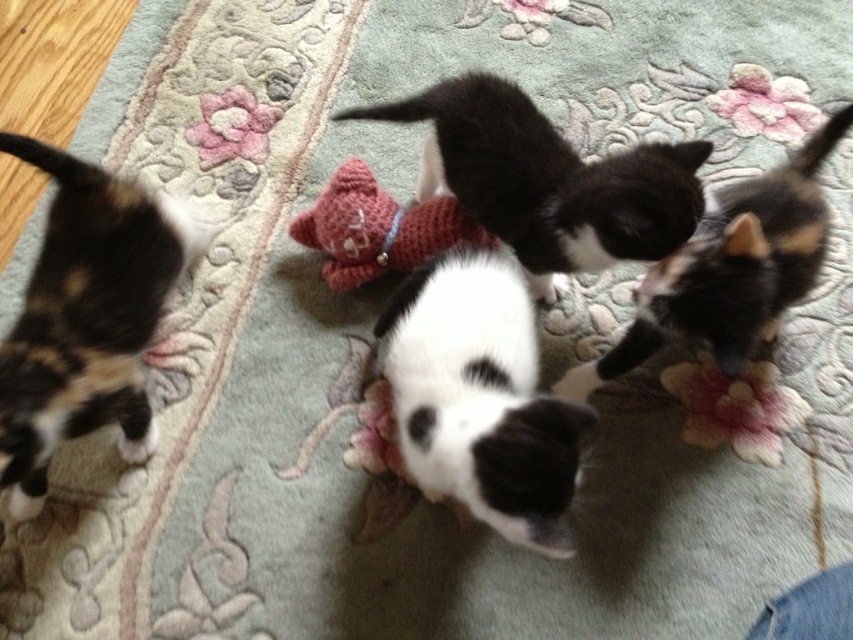
Question: Is calico fur cat at left bigger than black matte fur cat at center?

Choices:
 (A) yes
 (B) no

Answer: (B)

Question: Which point is farther to the camera?

Choices:
 (A) click(x=419, y=237)
 (B) click(x=85, y=240)
 (C) click(x=515, y=412)
 (D) click(x=618, y=179)

Answer: (A)

Question: Is black and white fur at center thinner than black fur cat at upper right?

Choices:
 (A) yes
 (B) no

Answer: (A)

Question: Which point is farther from the camera taking this photo?

Choices:
 (A) (744, 355)
 (B) (392, 232)
 (C) (577, 250)
 (D) (102, 342)

Answer: (B)

Question: Which point appears closest to the camera in this image?

Choices:
 (A) (480, 497)
 (B) (648, 285)
 (C) (567, 221)

Answer: (A)

Question: Observing the image, what is the correct spatial positioning of black matte fur cat at center in reference to black fur cat at upper right?

Choices:
 (A) above
 (B) below

Answer: (A)